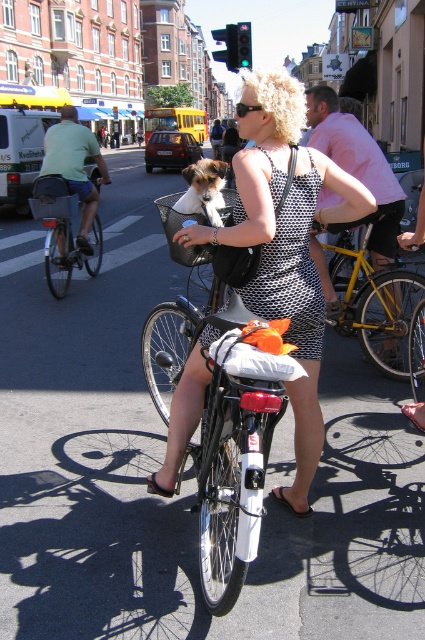
Between pink fabric shirt at upper right and yellow metallic bicycle at center-right, which one appears on the left side from the viewer's perspective?

pink fabric shirt at upper right

Can you confirm if pink fabric shirt at upper right is positioned below yellow metallic bicycle at center-right?

No, pink fabric shirt at upper right is not below yellow metallic bicycle at center-right.

Is point (396, 352) positioned after point (416, 291)?

No, it is in front of (416, 291).

Where is `pink fabric shirt at upper right`? The width and height of the screenshot is (425, 640). pink fabric shirt at upper right is located at coordinates (357, 164).

Which is in front, point (254, 486) or point (190, 179)?

Point (254, 486)

Can you confirm if black matte bicycle at center is thinner than soft brown fur at center?

Incorrect, black matte bicycle at center's width is not less than soft brown fur at center's.

Who is more forward, (166, 330) or (206, 177)?

Point (206, 177) is in front.

This screenshot has width=425, height=640. I want to click on black matte bicycle at center, so click(x=231, y=480).

Can you confirm if black matte bicycle at center is wider than silver metallic bicycle at left?

No, black matte bicycle at center is not wider than silver metallic bicycle at left.

Which of these two, black matte bicycle at center or silver metallic bicycle at left, stands shorter?

With less height is silver metallic bicycle at left.

You are a GUI agent. You are given a task and a screenshot of the screen. Output one action in this format:
    pyautogui.click(x=<x>, y=<y>)
    Task: Click on the black matte bicycle at center
    The height and width of the screenshot is (640, 425).
    Given the screenshot: What is the action you would take?
    pyautogui.click(x=231, y=480)